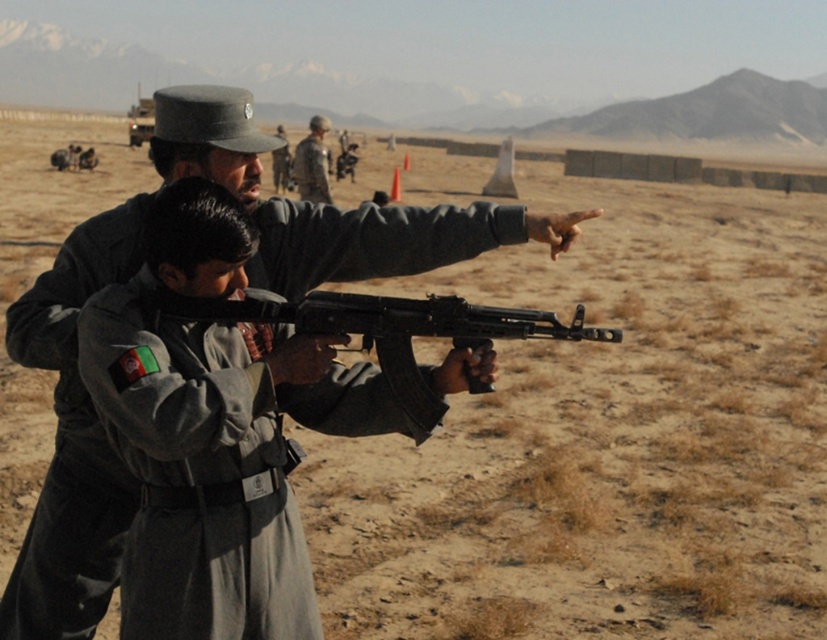
You are a photographer positioned at the center of the desert scene. You want to take a photo that includes both the matte black rifle at center and the camouflage fabric uniform at center. Given their distance apart, will you be able to capture both in a single frame without moving your camera position?

The matte black rifle at center and camouflage fabric uniform at center are 11.28 meters apart from each other. Whether they can be captured in a single frame depends on the camera lens used. A wide angle lens would likely include both, while a telephoto lens might not. However, since the question doesn

You are a photographer positioned at the center of the desert scene. You want to take a closeup shot of the matte black rifle at center and the camouflage fabric uniform at center. Which object should you focus on first to ensure it appears sharp in your photo?

The matte black rifle at center is closer to the viewer than the camouflage fabric uniform at center, so you should focus on the matte black rifle at center first to ensure it appears sharp in your photo.

You are a photographer standing in the desert scene. You need to take a photo that includes both the matte black rifle at center and the camouflage fabric uniform at center. Which object should you position to the left side of your frame to ensure both are visible?

You should position the camouflage fabric uniform at center to the left side of your frame because the matte black rifle at center is to the right of it, ensuring both are visible in the photo.